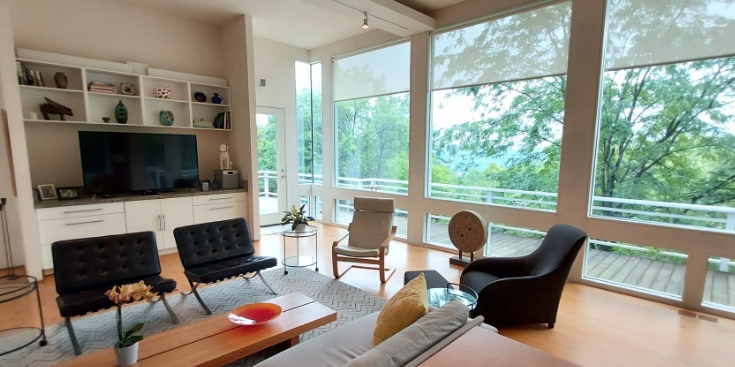
In order to click on door in this screenshot , I will do coord(262,152).